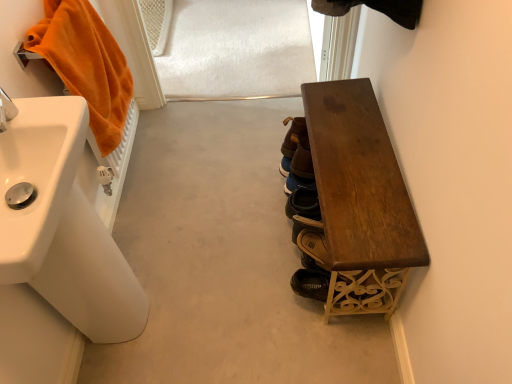
Describe the element at coordinates (6, 110) in the screenshot. I see `brushed metal faucet at upper left` at that location.

The height and width of the screenshot is (384, 512). In order to click on brown leather shoes at center, positioned as the first footwear in back-to-front order in this screenshot , I will do `click(297, 183)`.

Measure the distance between point (x=386, y=219) and camera.

The depth of point (x=386, y=219) is 3.77 feet.

This screenshot has height=384, width=512. I want to click on brushed metal faucet at upper left, so click(x=6, y=110).

Can you confirm if brushed metal faucet at upper left is positioned to the right of white glossy sink at left, which appears as the first sink when viewed from the back?

No, brushed metal faucet at upper left is not to the right of white glossy sink at left, which appears as the first sink when viewed from the back.

Looking at this image, from the image's perspective, is brushed metal faucet at upper left under white glossy sink at left, which appears as the first sink when viewed from the back?

Incorrect, from the image's perspective, brushed metal faucet at upper left is higher than white glossy sink at left, which appears as the first sink when viewed from the back.

Considering the sizes of objects brushed metal faucet at upper left and white glossy sink at left, which appears as the first sink when viewed from the back, in the image provided, who is taller, brushed metal faucet at upper left or white glossy sink at left, which appears as the first sink when viewed from the back,?

white glossy sink at left, which appears as the first sink when viewed from the back, is taller.

Relative to white glossy sink at left, which appears as the first sink when viewed from the back, is brushed metal faucet at upper left in front or behind?

brushed metal faucet at upper left is positioned closer to the viewer than white glossy sink at left, which appears as the first sink when viewed from the back.

Can you confirm if white glossy sink at left, which ranks as the 2th sink in back-to-front order, is smaller than brushed metal faucet at upper left?

No, white glossy sink at left, which ranks as the 2th sink in back-to-front order, is not smaller than brushed metal faucet at upper left.

Is white glossy sink at left, the 1th sink when ordered from front to back, oriented towards brushed metal faucet at upper left?

No, white glossy sink at left, the 1th sink when ordered from front to back, does not turn towards brushed metal faucet at upper left.

What's the angular difference between white glossy sink at left, which ranks as the 2th sink in back-to-front order, and brushed metal faucet at upper left's facing directions?

white glossy sink at left, which ranks as the 2th sink in back-to-front order, and brushed metal faucet at upper left are facing 0.00917 degrees away from each other.

Where is `tap behind the white glossy sink at left, which ranks as the 2th sink in back-to-front order`? tap behind the white glossy sink at left, which ranks as the 2th sink in back-to-front order is located at coordinates (6, 110).

Considering the relative positions of white glossy sink at left, which ranks as the 2th sink in back-to-front order, and white glossy sink at left, acting as the 2th sink starting from the front, in the image provided, is white glossy sink at left, which ranks as the 2th sink in back-to-front order, behind white glossy sink at left, acting as the 2th sink starting from the front,?

No, the depth of white glossy sink at left, which ranks as the 2th sink in back-to-front order, is less than that of white glossy sink at left, acting as the 2th sink starting from the front.

Could you tell me if white glossy sink at left, which ranks as the 2th sink in back-to-front order, is facing white glossy sink at left, acting as the 2th sink starting from the front?

No, white glossy sink at left, which ranks as the 2th sink in back-to-front order, is not facing towards white glossy sink at left, acting as the 2th sink starting from the front.

Measure the distance between white glossy sink at left, the 1th sink when ordered from front to back, and white glossy sink at left, acting as the 2th sink starting from the front.

4.89 inches.

From a real-world perspective, is brown leather shoe at lower center, which is the 3th footwear in top-to-bottom order, above or below brown leather shoes at center, positioned as the 3th footwear in front-to-back order?

brown leather shoe at lower center, which is the 3th footwear in top-to-bottom order, is situated lower than brown leather shoes at center, positioned as the 3th footwear in front-to-back order, in the real world.

Is brown leather shoe at lower center, arranged as the 3th footwear when viewed from the back, bigger or smaller than brown leather shoes at center, which is the second footwear in top-to-bottom order?

In the image, brown leather shoe at lower center, arranged as the 3th footwear when viewed from the back, appears to be larger than brown leather shoes at center, which is the second footwear in top-to-bottom order.

How far apart are brown leather shoe at lower center, arranged as the 3th footwear when viewed from the back, and brown leather shoes at center, which is the second footwear in top-to-bottom order?

brown leather shoe at lower center, arranged as the 3th footwear when viewed from the back, is 37.30 centimeters from brown leather shoes at center, which is the second footwear in top-to-bottom order.

Is point (324, 290) closer or farther from the camera than point (307, 183)?

Point (324, 290) appears to be closer to the viewer than point (307, 183).

From the image's perspective, starting from the orange plush towel at left, which sink is the 1st one below? Please provide its 2D coordinates.

[(37, 178)]

From a real-world perspective, is orange plush towel at left located beneath white glossy sink at left, the 1th sink when ordered from front to back?

Indeed, from a real-world perspective, orange plush towel at left is positioned beneath white glossy sink at left, the 1th sink when ordered from front to back.

Is orange plush towel at left not close to white glossy sink at left, the 1th sink when ordered from front to back?

orange plush towel at left is actually quite close to white glossy sink at left, the 1th sink when ordered from front to back.

Which of these two, orange plush towel at left or white glossy sink at left, which ranks as the 2th sink in back-to-front order, stands taller?

Standing taller between the two is orange plush towel at left.

Based on the photo, does orange plush towel at left have a lesser width compared to brushed metal faucet at upper left?

No.

Could you tell me if orange plush towel at left is facing brushed metal faucet at upper left?

No, orange plush towel at left is not turned towards brushed metal faucet at upper left.

Between orange plush towel at left and brushed metal faucet at upper left, which one is positioned in front?

brushed metal faucet at upper left.

Is dark wood bench at right in contact with orange plush towel at left?

dark wood bench at right and orange plush towel at left are clearly separated.

Who is taller, dark wood bench at right or orange plush towel at left?

With more height is orange plush towel at left.

Considering the relative sizes of dark wood bench at right and orange plush towel at left in the image provided, is dark wood bench at right bigger than orange plush towel at left?

Indeed, dark wood bench at right has a larger size compared to orange plush towel at left.

Between dark wood bench at right and orange plush towel at left, which one is positioned behind?

orange plush towel at left is more distant.

This screenshot has width=512, height=384. I want to click on tap that is on the left side of white glossy sink at left, acting as the 2th sink starting from the front, so click(x=6, y=110).

What are the coordinates of `tap above the white glossy sink at left, the 1th sink when ordered from front to back (from a real-world perspective)` in the screenshot? It's located at (6, 110).

Looking at the image, which one is located closer to brown leather shoes at center, the 2th footwear in the bottom-to-top sequence, white glossy sink at left, which ranks as the 2th sink in back-to-front order, or white glossy sink at left, which appears as the first sink when viewed from the back?

Based on the image, white glossy sink at left, which appears as the first sink when viewed from the back, appears to be nearer to brown leather shoes at center, the 2th footwear in the bottom-to-top sequence.

Considering their positions, is orange plush towel at left positioned further to white glossy sink at left, acting as the 2th sink starting from the front, than brushed metal faucet at upper left?

Among the two, orange plush towel at left is located further to white glossy sink at left, acting as the 2th sink starting from the front.

Estimate the real-world distances between objects in this image. Which object is further from white glossy sink at left, which ranks as the 2th sink in back-to-front order, brown leather shoes at center, positioned as the 3th footwear in front-to-back order, or brown leather shoe at lower center, acting as the 1th footwear starting from the front?

The object further to white glossy sink at left, which ranks as the 2th sink in back-to-front order, is brown leather shoes at center, positioned as the 3th footwear in front-to-back order.

From the image, which object appears to be nearer to brushed metal faucet at upper left, brown leather shoe at center, which is the first footwear from top to bottom, or white glossy sink at left, which appears as the first sink when viewed from the back?

white glossy sink at left, which appears as the first sink when viewed from the back, is positioned closer to the anchor brushed metal faucet at upper left.

From the image, which object appears to be nearer to brown leather shoe at lower center, which is the 3th footwear in top-to-bottom order, white glossy sink at left, the 1th sink when ordered from front to back, or brushed metal faucet at upper left?

white glossy sink at left, the 1th sink when ordered from front to back, is positioned closer to the anchor brown leather shoe at lower center, which is the 3th footwear in top-to-bottom order.

Based on their spatial positions, is white glossy sink at left, acting as the 2th sink starting from the front, or dark wood bench at right closer to brown leather shoe at lower center, acting as the 1th footwear starting from the front?

Based on the image, dark wood bench at right appears to be nearer to brown leather shoe at lower center, acting as the 1th footwear starting from the front.

Consider the image. Which object lies nearer to the anchor point brown leather shoes at center, which is the second footwear in top-to-bottom order, white glossy sink at left, which ranks as the 2th sink in back-to-front order, or brown leather shoe at lower center, arranged as the 3th footwear when viewed from the back?

brown leather shoe at lower center, arranged as the 3th footwear when viewed from the back, lies closer to brown leather shoes at center, which is the second footwear in top-to-bottom order, than the other object.

When comparing their distances from white glossy sink at left, which appears as the first sink when viewed from the back, does orange plush towel at left or brown leather shoes at center, positioned as the 3th footwear in front-to-back order, seem closer?

The object closer to white glossy sink at left, which appears as the first sink when viewed from the back, is orange plush towel at left.

The width and height of the screenshot is (512, 384). I want to click on footwear situated between orange plush towel at left and brown leather shoes at center, the 2th footwear in the bottom-to-top sequence, from left to right, so click(x=291, y=142).

Locate an element on the screen. This screenshot has height=384, width=512. footwear located between white glossy sink at left, which ranks as the 2th sink in back-to-front order, and brown leather shoe at center, the 3th footwear ordered from the bottom, in the depth direction is located at coordinates click(x=311, y=284).

This screenshot has height=384, width=512. I want to click on footwear between brushed metal faucet at upper left and brown leather shoes at center, which is the second footwear in top-to-bottom order, in the horizontal direction, so click(x=291, y=142).

The image size is (512, 384). Identify the location of bath towel between brushed metal faucet at upper left and dark wood bench at right. (86, 64).